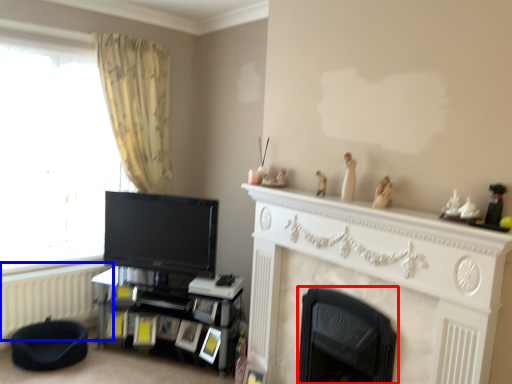
Question: Among these objects, which one is nearest to the camera, fireplace (highlighted by a red box) or radiator (highlighted by a blue box)?

Choices:
 (A) fireplace
 (B) radiator

Answer: (A)